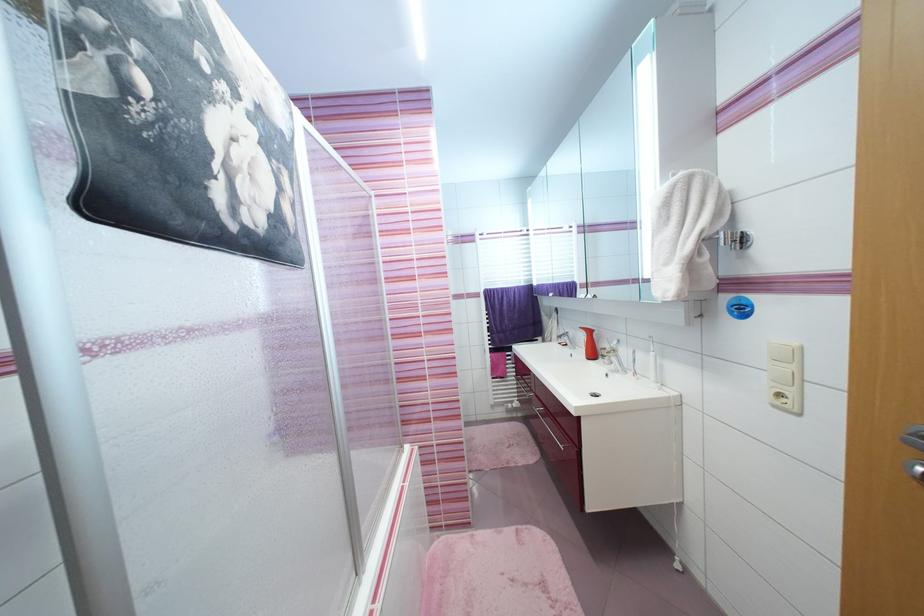
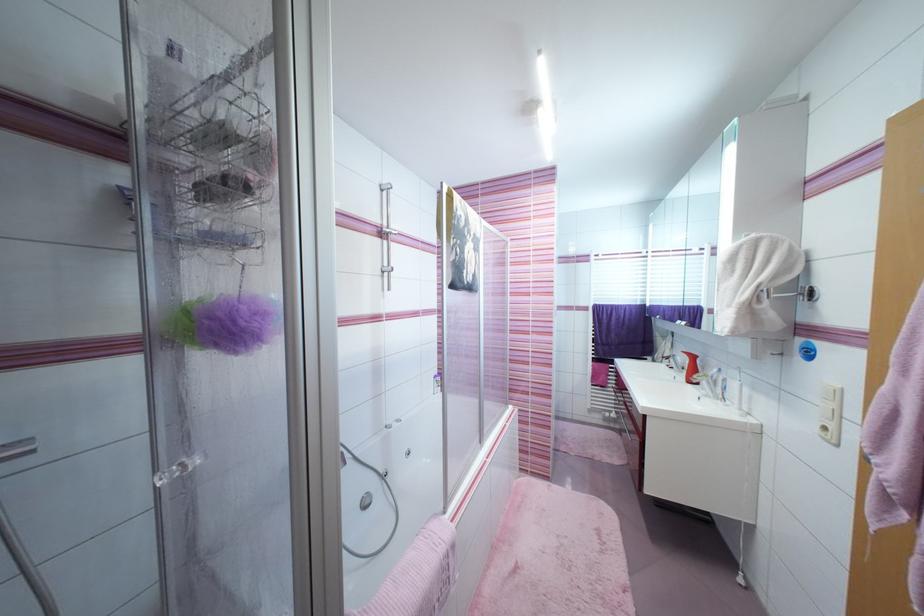
In the second image, find the point that corresponds to [618,373] in the first image.

(711, 398)